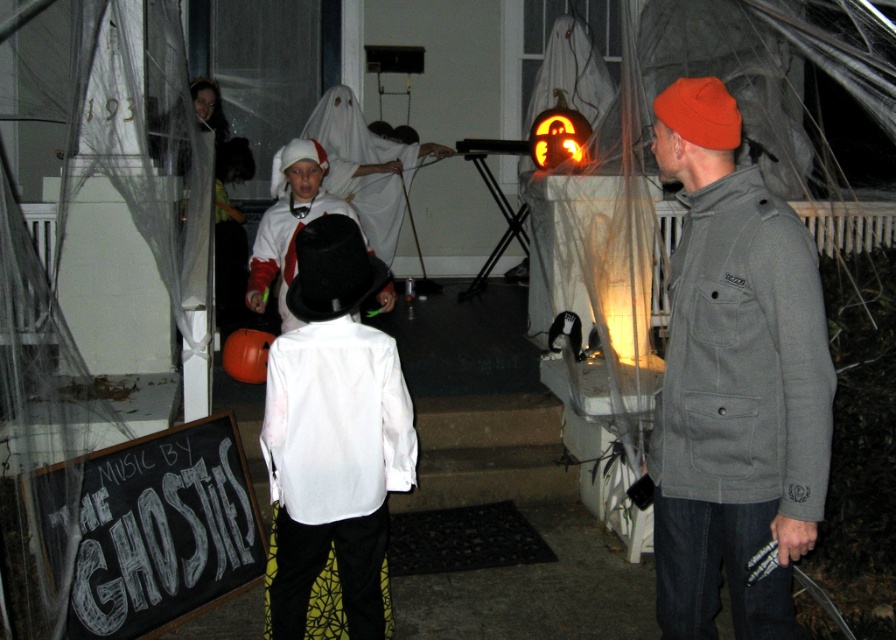
You are a costume designer preparing for a Halloween party. You have two items on your table, the white matte ghost at center and the white matte top hat at center. Which item should you choose if you need something that can be seen from a distance?

The white matte ghost at center is much taller than the white matte top hat at center, so it would be more visible from a distance.

You are standing on the porch and want to place a decorative item exactly at the center of the porch. The white satin shirt at center is currently occupying the center. Can you move it to another location without moving it more than 0.3 units in any direction? Please provide coordinates within the 2D space where you can place it.

The white satin shirt at center is currently at point [333,474]. To move it within 0.3 units without exceeding that distance, you can place it at coordinates like [602,474]. This location is 0.3 units above the original position and stays within the allowed movement range.